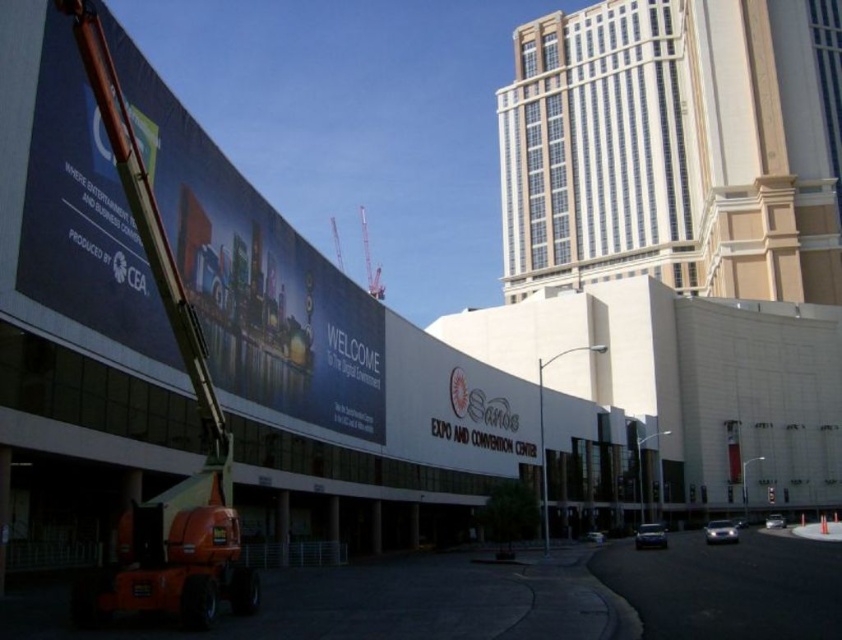
Consider the image. Measure the distance between point (176, 243) and camera.

They are 35.26 meters apart.

Does blue glossy billboard at upper left have a lesser height compared to metallic red crane at center?

Yes, blue glossy billboard at upper left is shorter than metallic red crane at center.

Between point (105, 330) and point (366, 275), which one is positioned behind?

The point (366, 275) is more distant.

Where is `blue glossy billboard at upper left`? This screenshot has width=842, height=640. blue glossy billboard at upper left is located at coordinates (254, 273).